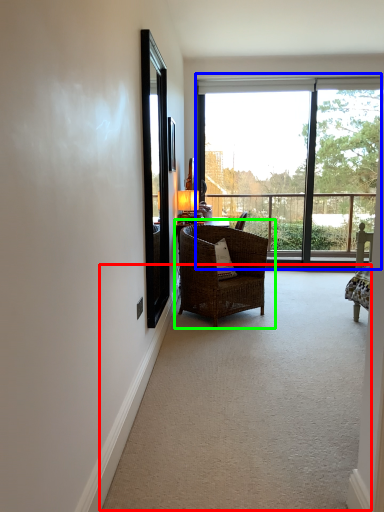
Question: Estimate the real-world distances between objects in this image. Which object is farther from corridor (highlighted by a red box), window (highlighted by a blue box) or chair (highlighted by a green box)?

Choices:
 (A) window
 (B) chair

Answer: (A)